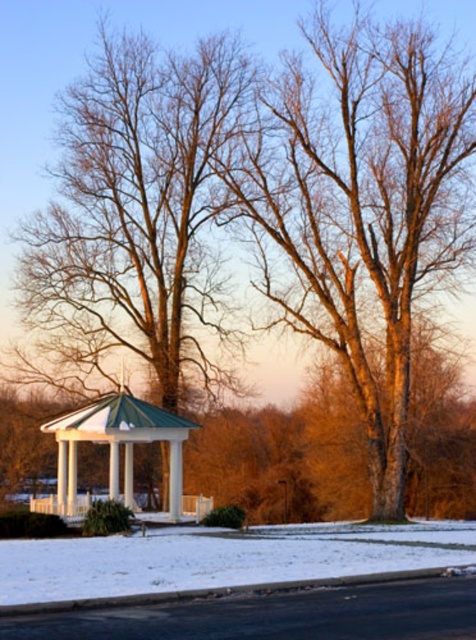
Question: Among these points, which one is farthest from the camera?

Choices:
 (A) (404, 145)
 (B) (247, 557)
 (C) (167, 429)
 (D) (214, 371)

Answer: (D)

Question: Can you confirm if white powdery snow at lower center is positioned below white glossy gazebo at center?

Choices:
 (A) no
 (B) yes

Answer: (A)

Question: Which of the following is the farthest from the observer?

Choices:
 (A) brown wood tree at center
 (B) white powdery snow at lower center
 (C) white glossy gazebo at center
 (D) bare wood tree at center

Answer: (A)

Question: Does white powdery snow at lower center come behind white glossy gazebo at center?

Choices:
 (A) no
 (B) yes

Answer: (A)

Question: Is brown wood tree at center wider than white glossy gazebo at center?

Choices:
 (A) yes
 (B) no

Answer: (A)

Question: Which object is positioned closest to the white powdery snow at lower center?

Choices:
 (A) brown wood tree at center
 (B) white glossy gazebo at center
 (C) bare wood tree at center

Answer: (B)